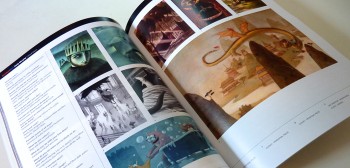
The width and height of the screenshot is (350, 168). Identify the location of tabletop. (30, 19).